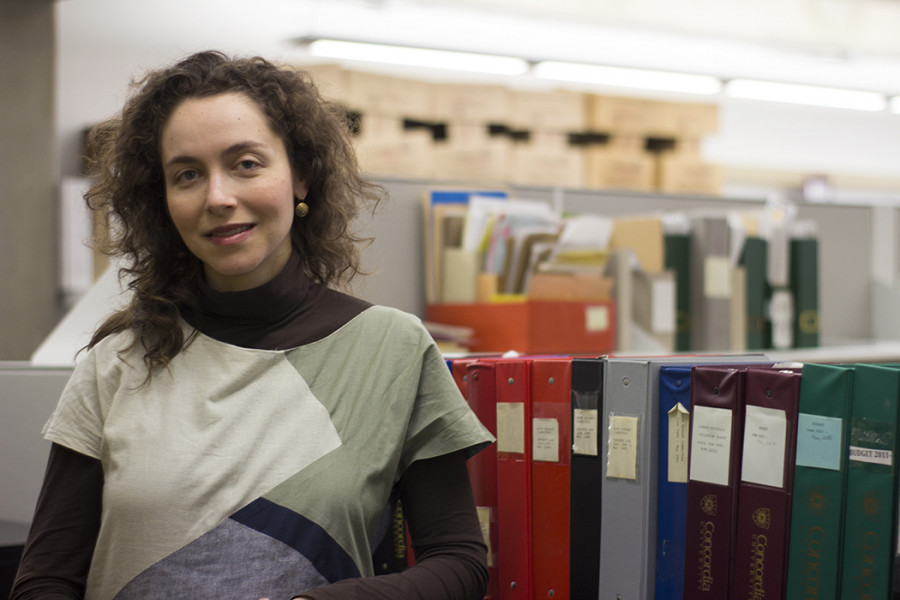
At what (x,y) coordinates should I click in order to perform the action: click on book. Please return your answer as a coordinate pair (x, y). The width and height of the screenshot is (900, 600). Looking at the image, I should click on (540, 408).